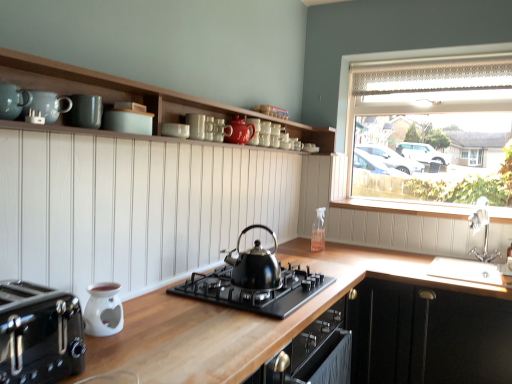
At what (x,y) coordinates should I click in order to perform the action: click on black plastic toaster at lower left, arranged as the 1th kitchen appliance when viewed from the front. Please return your answer as a coordinate pair (x, y). The image size is (512, 384). Looking at the image, I should click on (39, 334).

Describe the element at coordinates (318, 231) in the screenshot. I see `clear glass spray bottle at upper right` at that location.

Describe the element at coordinates (431, 128) in the screenshot. The height and width of the screenshot is (384, 512). I see `clear glass window at upper right` at that location.

In order to click on wooden at lower center in this screenshot , I will do `click(245, 319)`.

Find the location of `black plastic toaster at lower left, which appears as the 2th kitchen appliance when viewed from the back`. black plastic toaster at lower left, which appears as the 2th kitchen appliance when viewed from the back is located at coordinates (39, 334).

Could wooden at lower center be considered to be inside matte white mug at upper center, the 2th mug viewed from the front?

That's incorrect, wooden at lower center is not inside matte white mug at upper center, the 2th mug viewed from the front.

From a real-world perspective, which is physically below, matte white mug at upper center, positioned as the 1th mug in back-to-front order, or wooden at lower center?

wooden at lower center.

Which object is positioned more to the right, matte white mug at upper center, positioned as the 1th mug in back-to-front order, or wooden at lower center?

Positioned to the right is wooden at lower center.

Which object is further away from the camera, matte white mug at upper center, the 2th mug viewed from the front, or wooden at lower center?

matte white mug at upper center, the 2th mug viewed from the front.

Are black polished kettle at center and teal ceramic mug at upper left, which is the 1th teal in front-to-back order, far apart?

Yes, black polished kettle at center and teal ceramic mug at upper left, which is the 1th teal in front-to-back order, are quite far apart.

Is black polished kettle at center oriented away from teal ceramic mug at upper left, arranged as the second teal when viewed from the back?

That's not correct — black polished kettle at center is not looking away from teal ceramic mug at upper left, arranged as the second teal when viewed from the back.

Which is correct: black polished kettle at center is inside teal ceramic mug at upper left, arranged as the second teal when viewed from the back, or outside of it?

The correct answer is: outside.

From a real-world perspective, is matte white mug at upper center, the 2th mug viewed from the front, on black matte gas stove at center?

Yes, from a real-world perspective, matte white mug at upper center, the 2th mug viewed from the front, is over black matte gas stove at center

Based on their sizes in the image, would you say matte white mug at upper center, which is the second mug from left to right, is bigger or smaller than black matte gas stove at center?

matte white mug at upper center, which is the second mug from left to right, is smaller than black matte gas stove at center.

Which is in front, matte white mug at upper center, positioned as the 1th mug in back-to-front order, or black matte gas stove at center?

black matte gas stove at center is more forward.

Looking at this image, is matte white mug at upper center, which is the second mug from left to right, facing away from black matte gas stove at center?

No, matte white mug at upper center, which is the second mug from left to right, is not facing away from black matte gas stove at center.

Considering the relative positions of clear glass spray bottle at upper right and matte ceramic teapot at upper center in the image provided, is clear glass spray bottle at upper right to the left of matte ceramic teapot at upper center from the viewer's perspective?

Incorrect, clear glass spray bottle at upper right is not on the left side of matte ceramic teapot at upper center.

Is clear glass spray bottle at upper right looking in the opposite direction of matte ceramic teapot at upper center?

No, clear glass spray bottle at upper right's orientation is not away from matte ceramic teapot at upper center.

Is clear glass spray bottle at upper right spatially inside matte ceramic teapot at upper center, or outside of it?

clear glass spray bottle at upper right is not enclosed by matte ceramic teapot at upper center.

Is point (471, 218) positioned in front of point (65, 295)?

No.

Is white ceramic sink at right placed right next to black plastic toaster at lower left, which appears as the 2th kitchen appliance when viewed from the back?

white ceramic sink at right is not next to black plastic toaster at lower left, which appears as the 2th kitchen appliance when viewed from the back, and they're not touching.

The height and width of the screenshot is (384, 512). Find the location of `the 1st kitchen appliance below the white ceramic sink at right (from the image's perspective)`. the 1st kitchen appliance below the white ceramic sink at right (from the image's perspective) is located at coordinates (39, 334).

From the picture: Is black plastic toaster at lower left, arranged as the 1th kitchen appliance when viewed from the front, smaller than black matte gas stove at center?

Yes, black plastic toaster at lower left, arranged as the 1th kitchen appliance when viewed from the front, is smaller than black matte gas stove at center.

What's the angular difference between black plastic toaster at lower left, which appears as the 2th kitchen appliance when viewed from the back, and black matte gas stove at center's facing directions?

They differ by 1.4 degrees in their facing directions.

Considering the sizes of objects black plastic toaster at lower left, arranged as the 1th kitchen appliance when viewed from the front, and black matte gas stove at center in the image provided, who is wider, black plastic toaster at lower left, arranged as the 1th kitchen appliance when viewed from the front, or black matte gas stove at center?

black matte gas stove at center is wider.

Would you say black matte gas stove at center is part of black plastic toaster at lower left, arranged as the 1th kitchen appliance when viewed from the front,'s contents?

No, black matte gas stove at center is not a part of black plastic toaster at lower left, arranged as the 1th kitchen appliance when viewed from the front.

From the image's perspective, is black matte gas stove at center located above matte ceramic teapot at upper center?

Incorrect, from the image's perspective, black matte gas stove at center is lower than matte ceramic teapot at upper center.

Based on their sizes in the image, would you say black matte gas stove at center is bigger or smaller than matte ceramic teapot at upper center?

In the image, black matte gas stove at center appears to be larger than matte ceramic teapot at upper center.

Is black matte gas stove at center not inside matte ceramic teapot at upper center?

black matte gas stove at center lies outside matte ceramic teapot at upper center's area.

This screenshot has height=384, width=512. Find the location of `countertop below the matte white mug at upper center, positioned as the 1th mug in back-to-front order (from a real-world perspective)`. countertop below the matte white mug at upper center, positioned as the 1th mug in back-to-front order (from a real-world perspective) is located at coordinates (245, 319).

Which teal is the 2nd one when counting from the front of the black polished kettle at center? Please provide its 2D coordinates.

[(13, 101)]

Estimate the real-world distances between objects in this image. Which object is closer to white ceramic oil burner at lower left, the first kitchen appliance viewed from the back, white ceramic sink at right or black matte cabinet at lower right, which appears as the 1th cabinetry when viewed from the right?

black matte cabinet at lower right, which appears as the 1th cabinetry when viewed from the right.

Based on their spatial positions, is wooden shelves at upper center, the second cabinetry in the right-to-left sequence, or white ceramic oil burner at lower left, the first kitchen appliance viewed from the back, further from black matte cabinet at lower right, which appears as the 1th cabinetry when viewed from the right?

white ceramic oil burner at lower left, the first kitchen appliance viewed from the back, lies further to black matte cabinet at lower right, which appears as the 1th cabinetry when viewed from the right, than the other object.

Based on their spatial positions, is black matte gas stove at center or black polished kettle at center closer to matte ceramic teapot at upper center?

black polished kettle at center is positioned closer to the anchor matte ceramic teapot at upper center.

When comparing their distances from teal ceramic mug at upper left, arranged as the second teal when viewed from the back, does black polished kettle at center or matte gray mug at upper center, arranged as the second mug when viewed from the right, seem further?

black polished kettle at center.

Considering their positions, is matte ceramic teapot at upper center positioned closer to wooden shelves at upper center, the 1th cabinetry positioned from the top, than matte gray mug at upper center, marked as the 2th mug in a back-to-front arrangement?

Based on the image, matte gray mug at upper center, marked as the 2th mug in a back-to-front arrangement, appears to be nearer to wooden shelves at upper center, the 1th cabinetry positioned from the top.

Based on their spatial positions, is matte white mug at upper center, which appears as the first mug when viewed from the right, or wooden shelves at upper center, the first cabinetry viewed from the left, further from black polished kettle at center?

Among the two, wooden shelves at upper center, the first cabinetry viewed from the left, is located further to black polished kettle at center.

Considering their positions, is teal ceramic mug at upper left, arranged as the second teal when viewed from the back, positioned closer to black matte gas stove at center than black plastic toaster at lower left, arranged as the 1th kitchen appliance when viewed from the front?

The object closer to black matte gas stove at center is black plastic toaster at lower left, arranged as the 1th kitchen appliance when viewed from the front.

Based on their spatial positions, is clear glass window at upper right or teal matte mugs at upper center, arranged as the 2th teal when viewed from the front, closer to black matte cabinet at lower right, marked as the second cabinetry in a left-to-right arrangement?

Based on the image, clear glass window at upper right appears to be nearer to black matte cabinet at lower right, marked as the second cabinetry in a left-to-right arrangement.

Identify the location of gas stove between wooden shelves at upper center, the second cabinetry in the right-to-left sequence, and wooden at lower center vertically. The height and width of the screenshot is (384, 512). 255,291.

Locate an element on the screen. gas stove between wooden shelves at upper center, the second cabinetry in the right-to-left sequence, and wooden at upper right from front to back is located at coordinates (255, 291).

Where is `bottle located between matte gray mug at upper center, which is the first mug from left to right, and white ceramic sink at right in the left-right direction`? The height and width of the screenshot is (384, 512). bottle located between matte gray mug at upper center, which is the first mug from left to right, and white ceramic sink at right in the left-right direction is located at coordinates (318, 231).

The width and height of the screenshot is (512, 384). I want to click on sink between wooden at lower center and wooden at upper right from front to back, so click(484, 230).